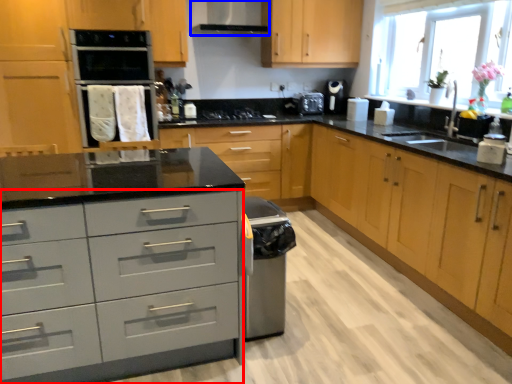
Question: Which of the following is the farthest to the observer, drawer (highlighted by a red box) or exhaust hood (highlighted by a blue box)?

Choices:
 (A) drawer
 (B) exhaust hood

Answer: (B)